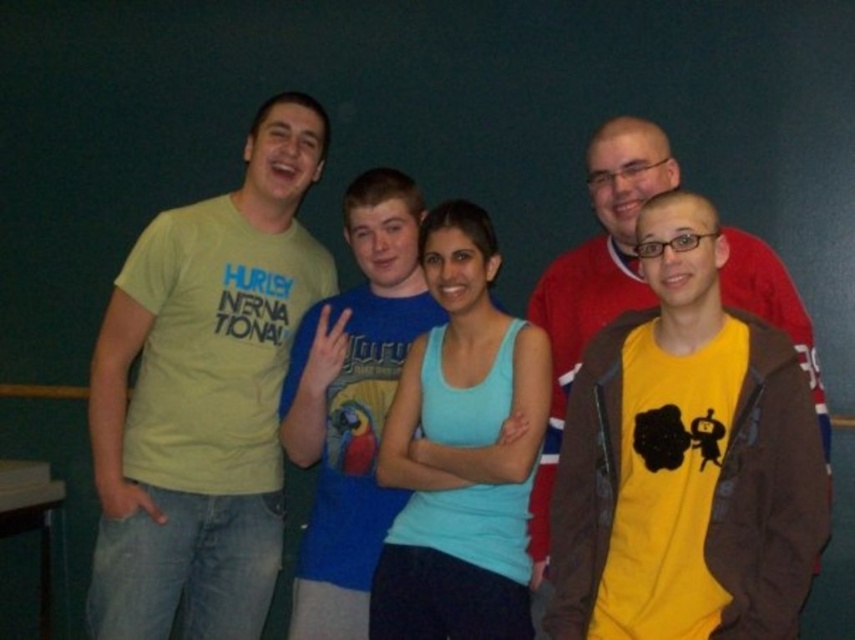
Question: Does matte yellow t-shirt at left lie behind blue cotton t-shirt at center?

Choices:
 (A) no
 (B) yes

Answer: (B)

Question: Which of the following is the closest to the observer?

Choices:
 (A) blue cotton t-shirt at center
 (B) light blue tank top at center
 (C) yellow matte shirt at right

Answer: (C)

Question: Among these points, which one is nearest to the camera?

Choices:
 (A) (226, 428)
 (B) (606, 321)
 (C) (503, 499)

Answer: (C)

Question: Can you confirm if light blue tank top at center is smaller than blue cotton t-shirt at center?

Choices:
 (A) yes
 (B) no

Answer: (A)

Question: Does light blue tank top at center appear over blue cotton t-shirt at center?

Choices:
 (A) yes
 (B) no

Answer: (B)

Question: Which of the following is the farthest from the observer?

Choices:
 (A) (263, 113)
 (B) (352, 621)
 (C) (786, 308)
 (D) (455, 403)

Answer: (A)